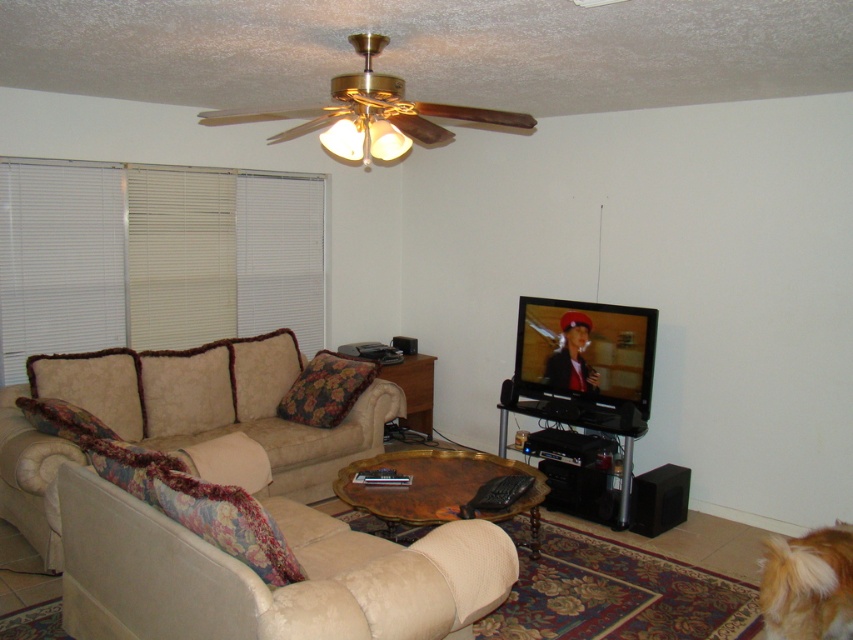
Question: Can you confirm if white fabric blinds at left is positioned to the right of beige fabric couch at lower left?

Choices:
 (A) no
 (B) yes

Answer: (A)

Question: Among these objects, which one is farthest from the camera?

Choices:
 (A) white fabric blinds at left
 (B) beige velvety armchair at lower left
 (C) woodenwoodencoffee table at center

Answer: (A)

Question: Based on their relative distances, which object is farther from the white fabric blinds at left?

Choices:
 (A) beige fabric side table at center
 (B) beige velvety armchair at lower left
 (C) beige fabric couch at lower left

Answer: (B)

Question: Among these objects, which one is farthest from the camera?

Choices:
 (A) beige fabric side table at center
 (B) beige fabric couch at lower left

Answer: (A)

Question: Does white fabric blinds at left have a greater width compared to beige velvety armchair at lower left?

Choices:
 (A) yes
 (B) no

Answer: (B)

Question: In this image, where is white fabric blinds at left located relative to golden fur dog at lower right?

Choices:
 (A) left
 (B) right

Answer: (A)